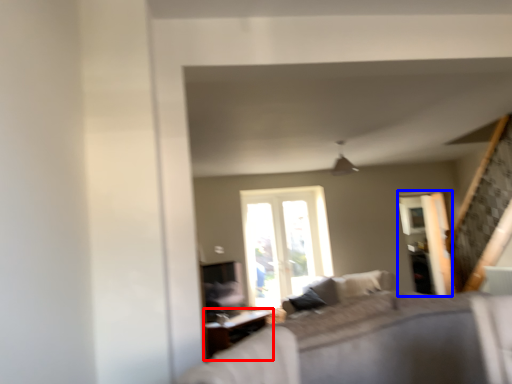
Question: Which of the following is the farthest to the observer, table (highlighted by a red box) or screen door (highlighted by a blue box)?

Choices:
 (A) table
 (B) screen door

Answer: (B)